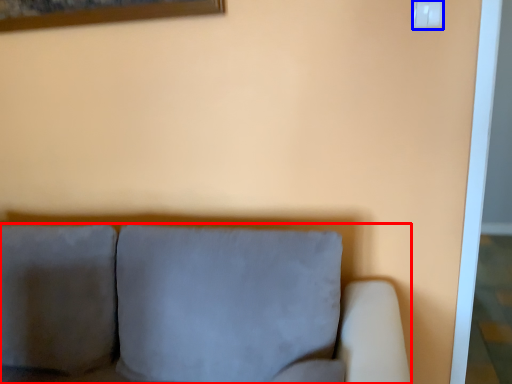
Question: Which object is closer to the camera taking this photo, studio couch (highlighted by a red box) or electric outlet (highlighted by a blue box)?

Choices:
 (A) studio couch
 (B) electric outlet

Answer: (A)